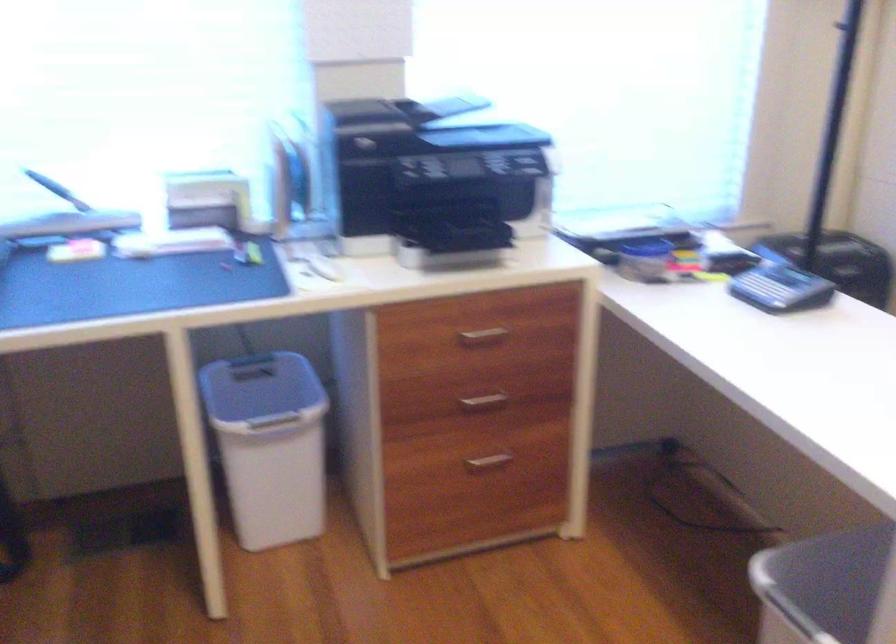
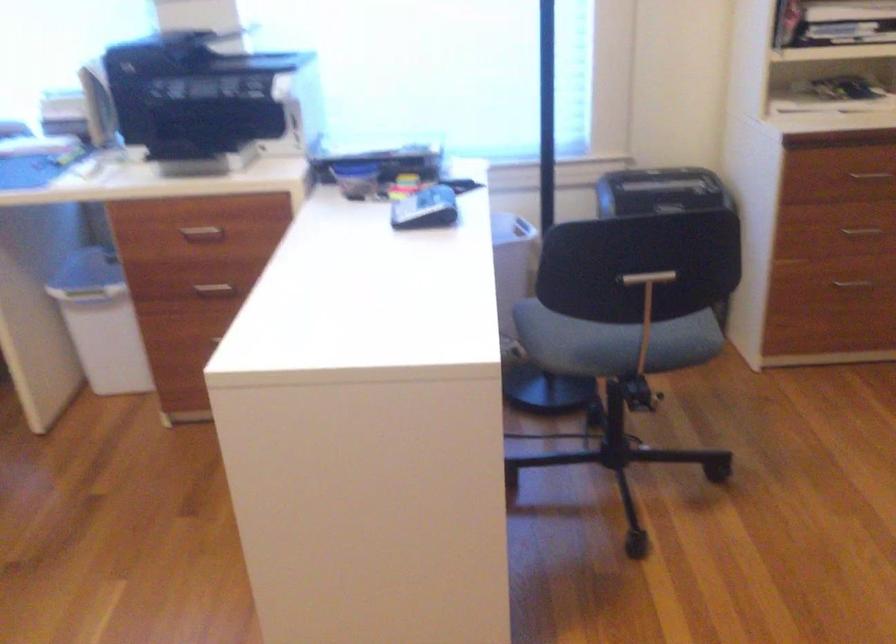
Question: Which direction would the cameraman need to move to produce the second image? Reply with the corresponding letter.

Choices:
 (A) Left
 (B) Right
 (C) Forward
 (D) Backward

Answer: (B)